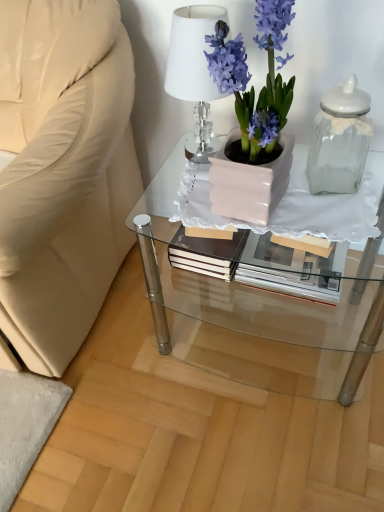
What do you see at coordinates (339, 140) in the screenshot? I see `clear glass jar at right` at bounding box center [339, 140].

The height and width of the screenshot is (512, 384). What do you see at coordinates (194, 72) in the screenshot?
I see `white crystal lamp at upper center` at bounding box center [194, 72].

Where is `white crystal lamp at upper center`? white crystal lamp at upper center is located at coordinates (194, 72).

Describe the element at coordinates (265, 300) in the screenshot. I see `matte white glass table at center` at that location.

Find the location of a particular element. This screenshot has width=384, height=512. clear glass jar at right is located at coordinates (339, 140).

Does point (211, 20) appear closer or farther from the camera than point (248, 78)?

Point (211, 20) is farther from the camera than point (248, 78).

Is the surface of white crystal lamp at upper center in direct contact with matte pink pot at center?

No, white crystal lamp at upper center is not next to matte pink pot at center.

From a real-world perspective, between white crystal lamp at upper center and matte pink pot at center, who is vertically lower?

Result: white crystal lamp at upper center, from a real-world perspective.

Does matte pink pot at center have a greater width compared to matte white glass table at center?

Incorrect, the width of matte pink pot at center does not surpass that of matte white glass table at center.

From a real-world perspective, is matte pink pot at center on matte white glass table at center?

Yes, from a real-world perspective, matte pink pot at center is above matte white glass table at center.

Is the surface of matte pink pot at center in direct contact with matte white glass table at center?

They are not placed beside each other.

Is matte pink pot at center to the left of white crystal lamp at upper center from the viewer's perspective?

Incorrect, matte pink pot at center is not on the left side of white crystal lamp at upper center.

From the image's perspective, is matte pink pot at center positioned above or below white crystal lamp at upper center?

Clearly, from the image's perspective, matte pink pot at center is below white crystal lamp at upper center.

Considering the relative positions of matte pink pot at center and white crystal lamp at upper center in the image provided, is matte pink pot at center in front of white crystal lamp at upper center?

Yes, matte pink pot at center is closer to the viewer.

Which is in front, point (280, 26) or point (199, 103)?

Point (280, 26)

Identify the location of table that appears below the matte pink pot at center (from the image's perspective). pos(265,300).

Is matte white glass table at center bigger than matte pink pot at center?

Yes, matte white glass table at center is bigger than matte pink pot at center.

Is matte white glass table at center facing away from matte pink pot at center?

No, matte white glass table at center is not facing the opposite direction of matte pink pot at center.

From a real-world perspective, is matte white glass table at center physically below white crystal lamp at upper center?

Yes.

Is point (318, 371) positioned after point (205, 78)?

Yes, point (318, 371) is farther from viewer.

Considering the sizes of objects matte white glass table at center and white crystal lamp at upper center in the image provided, who is shorter, matte white glass table at center or white crystal lamp at upper center?

Standing shorter between the two is white crystal lamp at upper center.

Is matte white glass table at center closer to the viewer compared to white crystal lamp at upper center?

Yes, it is.

Between clear glass jar at right and white crystal lamp at upper center, which one has smaller width?

Thinner between the two is clear glass jar at right.

What's the angular difference between clear glass jar at right and white crystal lamp at upper center's facing directions?

clear glass jar at right and white crystal lamp at upper center are facing 13.1 degrees away from each other.

Locate an element on the screen. This screenshot has width=384, height=512. bottle below the white crystal lamp at upper center (from the image's perspective) is located at coordinates (339, 140).

Considering the positions of point (356, 127) and point (192, 98), is point (356, 127) closer or farther from the camera than point (192, 98)?

Point (356, 127) is closer to the camera than point (192, 98).

Is matte white glass table at center at the back of clear glass jar at right?

clear glass jar at right does not have its back to matte white glass table at center.

Who is bigger, clear glass jar at right or matte white glass table at center?

Bigger between the two is matte white glass table at center.

The image size is (384, 512). In order to click on bottle above the matte white glass table at center (from a real-world perspective) in this screenshot , I will do `click(339, 140)`.

From the image's perspective, which one is positioned lower, clear glass jar at right or matte white glass table at center?

matte white glass table at center, from the image's perspective.

I want to click on lamp that appears below the matte pink pot at center (from a real-world perspective), so click(x=194, y=72).

Identify the location of table below the matte pink pot at center (from the image's perspective). (265, 300).

Considering their positions, is clear glass jar at right positioned further to matte white glass table at center than white crystal lamp at upper center?

white crystal lamp at upper center lies further to matte white glass table at center than the other object.

Based on their spatial positions, is matte white glass table at center or clear glass jar at right further from white crystal lamp at upper center?

Among the two, matte white glass table at center is located further to white crystal lamp at upper center.

From the image, which object appears to be farther from matte white glass table at center, white crystal lamp at upper center or matte pink pot at center?

white crystal lamp at upper center is positioned further to the anchor matte white glass table at center.

Looking at this image, which object lies further to the anchor point matte white glass table at center, matte pink pot at center or clear glass jar at right?

matte pink pot at center.

Which object lies further to the anchor point matte pink pot at center, white crystal lamp at upper center or matte white glass table at center?

Answer: matte white glass table at center lies further to matte pink pot at center than the other object.

From the image, which object appears to be farther from clear glass jar at right, white crystal lamp at upper center or matte pink pot at center?

white crystal lamp at upper center.

Based on their spatial positions, is matte pink pot at center or white crystal lamp at upper center further from matte white glass table at center?

white crystal lamp at upper center is further to matte white glass table at center.

When comparing their distances from matte pink pot at center, does white crystal lamp at upper center or clear glass jar at right seem closer?

Among the two, white crystal lamp at upper center is located nearer to matte pink pot at center.

You are a GUI agent. You are given a task and a screenshot of the screen. Output one action in this format:
    pyautogui.click(x=<x>, y=<y>)
    Task: Click on the bottle between white crystal lamp at upper center and matte white glass table at center vertically
    This screenshot has width=384, height=512.
    Given the screenshot: What is the action you would take?
    pyautogui.click(x=339, y=140)

Find the location of a particular element. This screenshot has width=384, height=512. houseplant between white crystal lamp at upper center and matte white glass table at center vertically is located at coordinates (250, 77).

Locate an element on the screen. houseplant situated between white crystal lamp at upper center and clear glass jar at right from left to right is located at coordinates (250, 77).

The height and width of the screenshot is (512, 384). I want to click on bottle between matte pink pot at center and matte white glass table at center vertically, so click(339, 140).